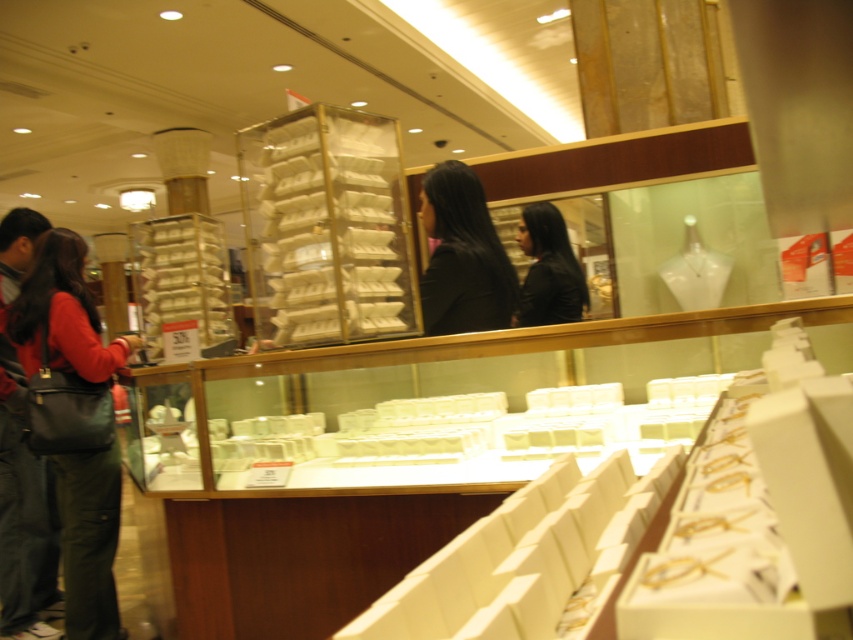
You are a customer in the jewelry store and want to know if the black matte hair at center is close enough to the black matte jacket at center to touch them both at the same time. Can you reach both items if you extend your arms fully?

The black matte hair at center is 59.05 centimeters away from the black matte jacket at center. Since the average human arm span is about 1.5 meters, which is much larger than 59.05 centimeters, you can easily reach both items at the same time.